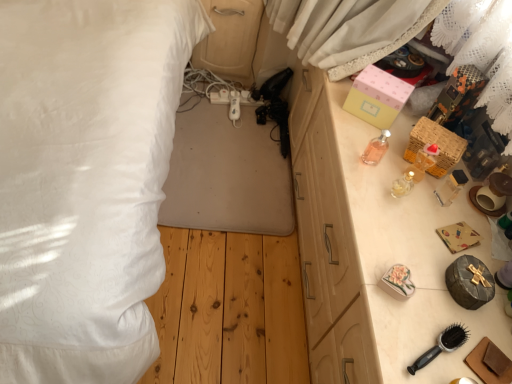
This screenshot has width=512, height=384. Find the location of `vacant area situated to the left side of woven wicker basket at right, marked as the second box in a top-to-bottom arrangement`. vacant area situated to the left side of woven wicker basket at right, marked as the second box in a top-to-bottom arrangement is located at coordinates (356, 145).